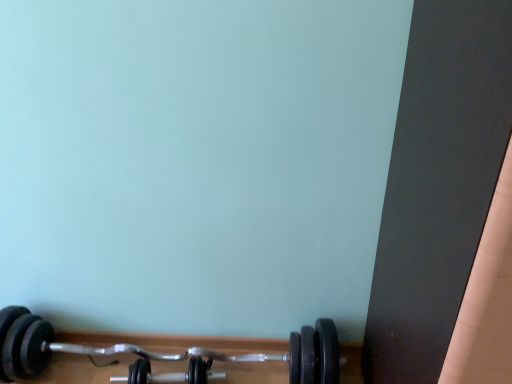
Image resolution: width=512 pixels, height=384 pixels. What do you see at coordinates (161, 353) in the screenshot? I see `black rubber dumbbell at lower center, the 1th dumbbell positioned from the left` at bounding box center [161, 353].

In order to click on black rubber dumbbell at lower center, positioned as the second dumbbell in right-to-left order in this screenshot , I will do `click(161, 353)`.

What do you see at coordinates (170, 373) in the screenshot? I see `black rubber dumbbell at lower center, the 1th dumbbell in the right-to-left sequence` at bounding box center [170, 373].

The image size is (512, 384). In order to click on black rubber dumbbell at lower center, the 2th dumbbell when ordered from left to right in this screenshot , I will do `click(170, 373)`.

I want to click on black rubber dumbbell at lower center, positioned as the second dumbbell in right-to-left order, so click(x=161, y=353).

In the image, is black rubber dumbbell at lower center, positioned as the second dumbbell in right-to-left order, on the left side or the right side of black rubber dumbbell at lower center, the 2th dumbbell when ordered from left to right?

black rubber dumbbell at lower center, positioned as the second dumbbell in right-to-left order, is positioned on black rubber dumbbell at lower center, the 2th dumbbell when ordered from left to right,'s left side.

Is black rubber dumbbell at lower center, the 1th dumbbell positioned from the left, closer to the viewer compared to black rubber dumbbell at lower center, the 2th dumbbell when ordered from left to right?

That is True.

Considering the points (149, 374) and (198, 383), which point is in front, point (149, 374) or point (198, 383)?

The point (198, 383) is closer to the camera.

From the image's perspective, which is below, black rubber dumbbell at lower center, positioned as the second dumbbell in right-to-left order, or black rubber dumbbell at lower center, the 1th dumbbell in the right-to-left sequence?

black rubber dumbbell at lower center, the 1th dumbbell in the right-to-left sequence, appears lower in the image.

From a real-world perspective, is black rubber dumbbell at lower center, the 1th dumbbell positioned from the left, above or below black rubber dumbbell at lower center, the 2th dumbbell when ordered from left to right?

black rubber dumbbell at lower center, the 1th dumbbell positioned from the left, is situated higher than black rubber dumbbell at lower center, the 2th dumbbell when ordered from left to right, in the real world.

Between black rubber dumbbell at lower center, positioned as the second dumbbell in right-to-left order, and black rubber dumbbell at lower center, the 2th dumbbell when ordered from left to right, which one has smaller width?

black rubber dumbbell at lower center, the 2th dumbbell when ordered from left to right.

Is black rubber dumbbell at lower center, positioned as the second dumbbell in right-to-left order, taller than black rubber dumbbell at lower center, the 1th dumbbell in the right-to-left sequence?

Yes.

Considering the sizes of objects black rubber dumbbell at lower center, positioned as the second dumbbell in right-to-left order, and black rubber dumbbell at lower center, the 2th dumbbell when ordered from left to right, in the image provided, who is smaller, black rubber dumbbell at lower center, positioned as the second dumbbell in right-to-left order, or black rubber dumbbell at lower center, the 2th dumbbell when ordered from left to right,?

black rubber dumbbell at lower center, the 2th dumbbell when ordered from left to right, is smaller.

Is black rubber dumbbell at lower center, the 1th dumbbell in the right-to-left sequence, inside black rubber dumbbell at lower center, the 1th dumbbell positioned from the left?

Yes, black rubber dumbbell at lower center, the 1th dumbbell positioned from the left, is surrounding black rubber dumbbell at lower center, the 1th dumbbell in the right-to-left sequence.

Can you see black rubber dumbbell at lower center, the 1th dumbbell positioned from the left, touching black rubber dumbbell at lower center, the 1th dumbbell in the right-to-left sequence?

black rubber dumbbell at lower center, the 1th dumbbell positioned from the left, and black rubber dumbbell at lower center, the 1th dumbbell in the right-to-left sequence, are not in contact.

Consider the image. Is black rubber dumbbell at lower center, positioned as the second dumbbell in right-to-left order, oriented away from black rubber dumbbell at lower center, the 1th dumbbell in the right-to-left sequence?

Yes, black rubber dumbbell at lower center, positioned as the second dumbbell in right-to-left order, is positioned with its back facing black rubber dumbbell at lower center, the 1th dumbbell in the right-to-left sequence.

Locate an element on the screen. dumbbell below the black rubber dumbbell at lower center, the 1th dumbbell positioned from the left (from the image's perspective) is located at coordinates (170, 373).

Is black rubber dumbbell at lower center, the 2th dumbbell when ordered from left to right, to the right of black rubber dumbbell at lower center, positioned as the second dumbbell in right-to-left order, from the viewer's perspective?

Yes, black rubber dumbbell at lower center, the 2th dumbbell when ordered from left to right, is to the right of black rubber dumbbell at lower center, positioned as the second dumbbell in right-to-left order.

Which object is further away from the camera taking this photo, black rubber dumbbell at lower center, the 1th dumbbell in the right-to-left sequence, or black rubber dumbbell at lower center, positioned as the second dumbbell in right-to-left order?

black rubber dumbbell at lower center, the 1th dumbbell in the right-to-left sequence, is further from the camera.

Which point is more distant from viewer, (116, 378) or (115, 345)?

Positioned behind is point (115, 345).

Consider the image. From the image's perspective, which is above, black rubber dumbbell at lower center, the 1th dumbbell in the right-to-left sequence, or black rubber dumbbell at lower center, the 1th dumbbell positioned from the left?

black rubber dumbbell at lower center, the 1th dumbbell positioned from the left, appears higher in the image.

From a real-world perspective, is black rubber dumbbell at lower center, the 2th dumbbell when ordered from left to right, positioned above or below black rubber dumbbell at lower center, positioned as the second dumbbell in right-to-left order?

Clearly, from a real-world perspective, black rubber dumbbell at lower center, the 2th dumbbell when ordered from left to right, is below black rubber dumbbell at lower center, positioned as the second dumbbell in right-to-left order.

Which of these two, black rubber dumbbell at lower center, the 2th dumbbell when ordered from left to right, or black rubber dumbbell at lower center, the 1th dumbbell positioned from the left, is thinner?

black rubber dumbbell at lower center, the 2th dumbbell when ordered from left to right.

Considering the sizes of objects black rubber dumbbell at lower center, the 2th dumbbell when ordered from left to right, and black rubber dumbbell at lower center, the 1th dumbbell positioned from the left, in the image provided, who is taller, black rubber dumbbell at lower center, the 2th dumbbell when ordered from left to right, or black rubber dumbbell at lower center, the 1th dumbbell positioned from the left,?

black rubber dumbbell at lower center, the 1th dumbbell positioned from the left, is taller.

In terms of size, does black rubber dumbbell at lower center, the 1th dumbbell in the right-to-left sequence, appear bigger or smaller than black rubber dumbbell at lower center, the 1th dumbbell positioned from the left?

Considering their sizes, black rubber dumbbell at lower center, the 1th dumbbell in the right-to-left sequence, takes up less space than black rubber dumbbell at lower center, the 1th dumbbell positioned from the left.

Could black rubber dumbbell at lower center, positioned as the second dumbbell in right-to-left order, be considered to be inside black rubber dumbbell at lower center, the 2th dumbbell when ordered from left to right?

No, black rubber dumbbell at lower center, positioned as the second dumbbell in right-to-left order, is located outside of black rubber dumbbell at lower center, the 2th dumbbell when ordered from left to right.

Is there a large distance between black rubber dumbbell at lower center, the 2th dumbbell when ordered from left to right, and black rubber dumbbell at lower center, the 1th dumbbell positioned from the left?

They are positioned close to each other.

Is black rubber dumbbell at lower center, the 1th dumbbell in the right-to-left sequence, turned away from black rubber dumbbell at lower center, the 1th dumbbell positioned from the left?

Yes, black rubber dumbbell at lower center, the 1th dumbbell in the right-to-left sequence, is facing away from black rubber dumbbell at lower center, the 1th dumbbell positioned from the left.

Can you tell me how much black rubber dumbbell at lower center, the 2th dumbbell when ordered from left to right, and black rubber dumbbell at lower center, positioned as the second dumbbell in right-to-left order, differ in facing direction?

black rubber dumbbell at lower center, the 2th dumbbell when ordered from left to right, and black rubber dumbbell at lower center, positioned as the second dumbbell in right-to-left order, are facing 7.45 degrees away from each other.

In order to click on dumbbell behind the black rubber dumbbell at lower center, the 1th dumbbell positioned from the left in this screenshot , I will do `click(170, 373)`.

Image resolution: width=512 pixels, height=384 pixels. What are the coordinates of `dumbbell that appears above the black rubber dumbbell at lower center, the 2th dumbbell when ordered from left to right (from the image's perspective)` in the screenshot? It's located at (161, 353).

Identify the location of dumbbell behind the black rubber dumbbell at lower center, positioned as the second dumbbell in right-to-left order. The image size is (512, 384). (170, 373).